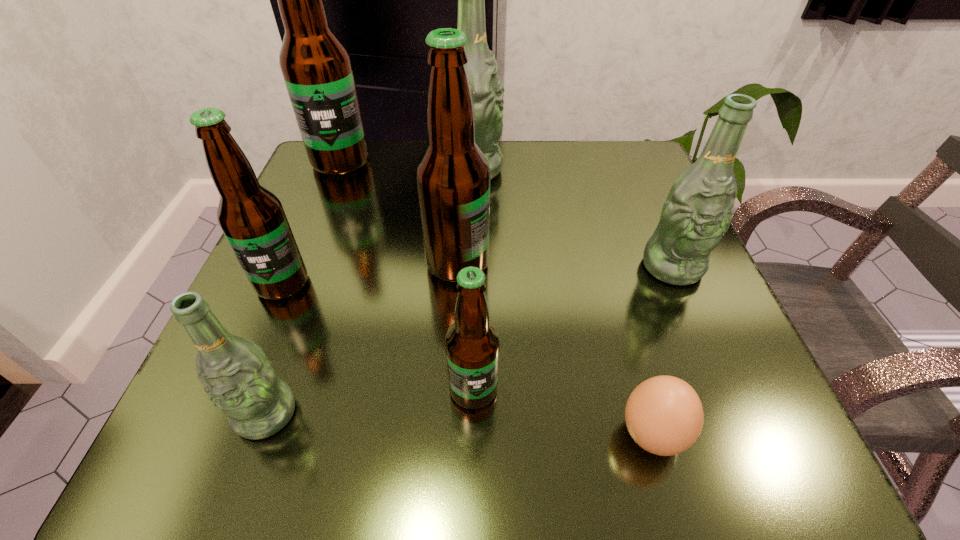
Image resolution: width=960 pixels, height=540 pixels. In order to click on boiled egg located at the near edge in this screenshot , I will do `click(664, 415)`.

The width and height of the screenshot is (960, 540). I want to click on beer bottle that is at the right edge, so click(697, 212).

This screenshot has height=540, width=960. I want to click on boiled egg at the right edge, so point(664,415).

Locate an element on the screen. This screenshot has width=960, height=540. object that is at the far left corner is located at coordinates (316, 66).

Locate an element on the screen. object situated at the near left corner is located at coordinates (239, 379).

I want to click on object that is at the near right corner, so click(664, 415).

I want to click on vacant area at the far edge of the desktop, so click(552, 188).

Locate an element on the screen. The width and height of the screenshot is (960, 540). free region at the near edge of the desktop is located at coordinates (427, 462).

This screenshot has width=960, height=540. Identify the location of free space at the right edge. (703, 370).

This screenshot has width=960, height=540. In the image, there is a desktop. In order to click on vacant area at the far left corner in this screenshot , I will do 303,198.